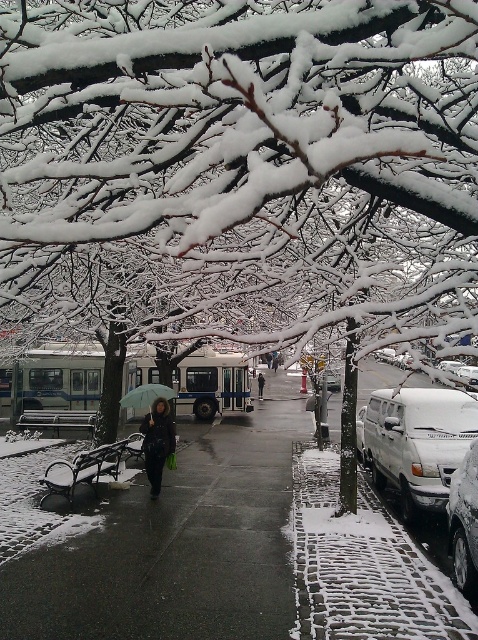
Question: Which object is positioned closest to the black matte jacket at center?

Choices:
 (A) green matte umbrella at center
 (B) shiny asphalt sidewalk at center
 (C) white matte van at lower right
 (D) snow-covered branches at upper center

Answer: (A)

Question: Is black matte coat at center positioned at the back of green matte umbrella at center?

Choices:
 (A) no
 (B) yes

Answer: (A)

Question: Which object is closer to the camera taking this photo?

Choices:
 (A) white matte van at right
 (B) shiny asphalt sidewalk at center

Answer: (B)

Question: Does white matte van at lower right appear over black matte coat at center?

Choices:
 (A) no
 (B) yes

Answer: (B)

Question: Which is nearer to the white matte van at lower right?

Choices:
 (A) shiny asphalt sidewalk at center
 (B) white matte van at center-right
 (C) black matte coat at center
 (D) snow-covered branches at upper center

Answer: (A)

Question: Can you confirm if white matte van at right is positioned to the right of green matte umbrella at center?

Choices:
 (A) no
 (B) yes

Answer: (B)